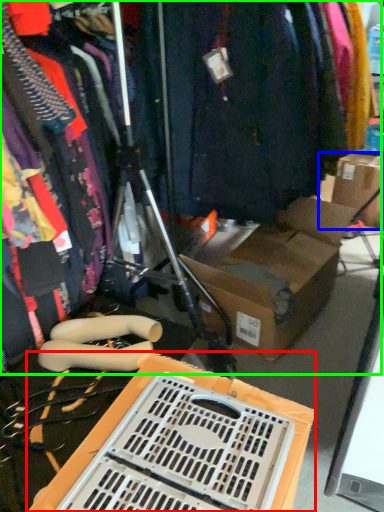
Question: Which object is the farthest from storage box (highlighted by a red box)? Choose among these: cardboard box (highlighted by a blue box) or closet (highlighted by a green box).

Choices:
 (A) cardboard box
 (B) closet

Answer: (A)